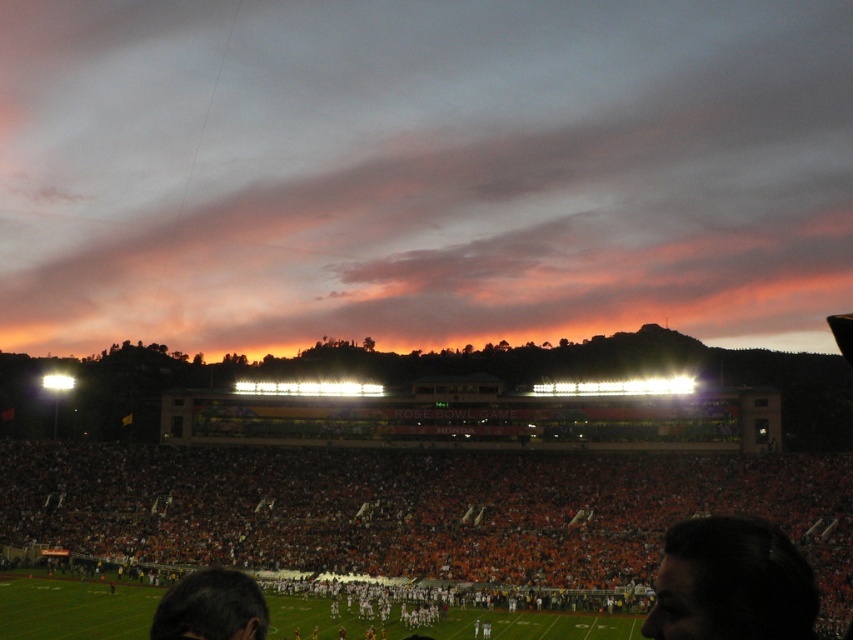
Is orange fabric crowd at lower center closer to the viewer compared to dark hair at lower right?

That is False.

Does orange fabric crowd at lower center have a lesser height compared to dark hair at lower right?

No, orange fabric crowd at lower center is not shorter than dark hair at lower right.

Locate an element on the screen. orange fabric crowd at lower center is located at coordinates (419, 509).

You are a GUI agent. You are given a task and a screenshot of the screen. Output one action in this format:
    pyautogui.click(x=<x>, y=<y>)
    Task: Click on the orange fabric crowd at lower center
    The width and height of the screenshot is (853, 640).
    Given the screenshot: What is the action you would take?
    pyautogui.click(x=419, y=509)

Between point (824, 548) and point (157, 614), which one is positioned in front?

Point (157, 614) is more forward.

Is point (611, 465) farther from viewer compared to point (238, 600)?

Yes, point (611, 465) is farther from viewer.

Who is more distant from viewer, (219, 481) or (165, 600)?

The point (219, 481) is behind.

Locate an element on the screen. This screenshot has width=853, height=640. orange fabric crowd at lower center is located at coordinates (419, 509).

Does dark hair at lower right have a greater width compared to dark hair at lower left?

Yes.

Between dark hair at lower right and dark hair at lower left, which one has less height?

dark hair at lower left

Is point (801, 595) closer to viewer compared to point (164, 609)?

Yes.

Locate an element on the screen. dark hair at lower right is located at coordinates (730, 582).